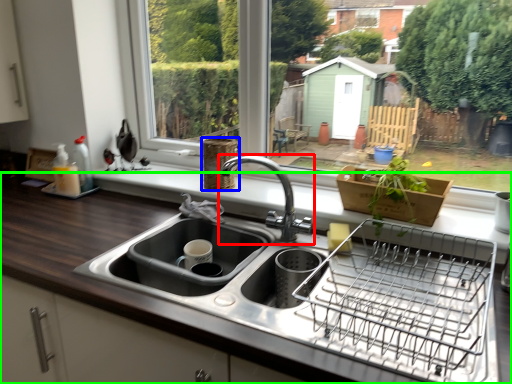
Question: Considering the real-world distances, which object is farthest from tap (highlighted by a red box)? basket (highlighted by a blue box) or countertop (highlighted by a green box)?

Choices:
 (A) basket
 (B) countertop

Answer: (B)